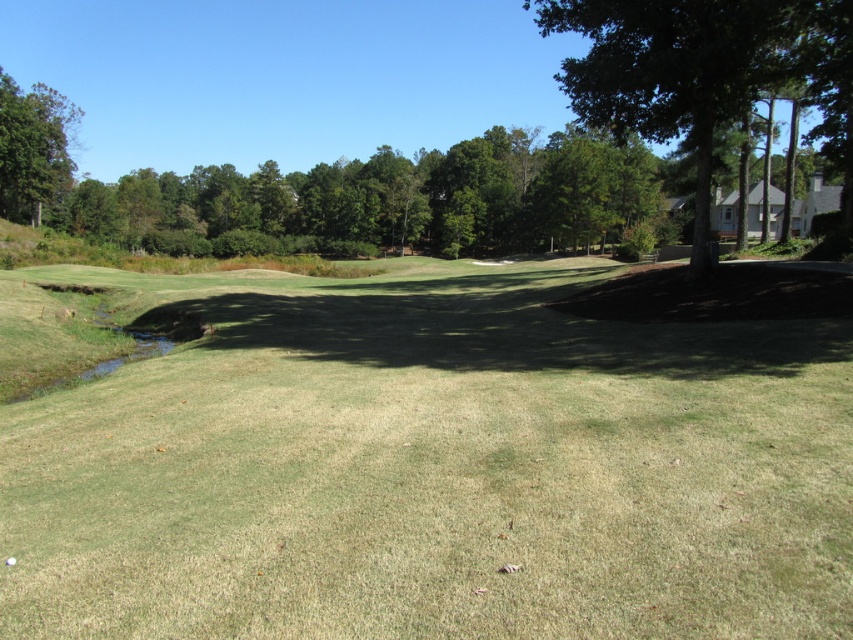
You are a golfer standing at the tee box on the right side of the golf course. You want to hit your ball to the green area located in the middle ground. There is an obstacle at point (434, 468) which is green grass at center. Can you safely hit your ball over the green grass at center without hitting the obstacle?

The obstacle at point (434, 468) is green grass at center, which is part of the fairway. Since grass is a natural surface on the course, you can safely hit your ball over it as it is not an obstruction according to golf rules.

You are a golfer standing on the fairway and want to hit your ball towards the green. There is a green leafy tree at upper left and green grass at center in your line of sight. Which object is positioned to the right of the other?

The green grass at center is to the right of the green leafy tree at upper left.